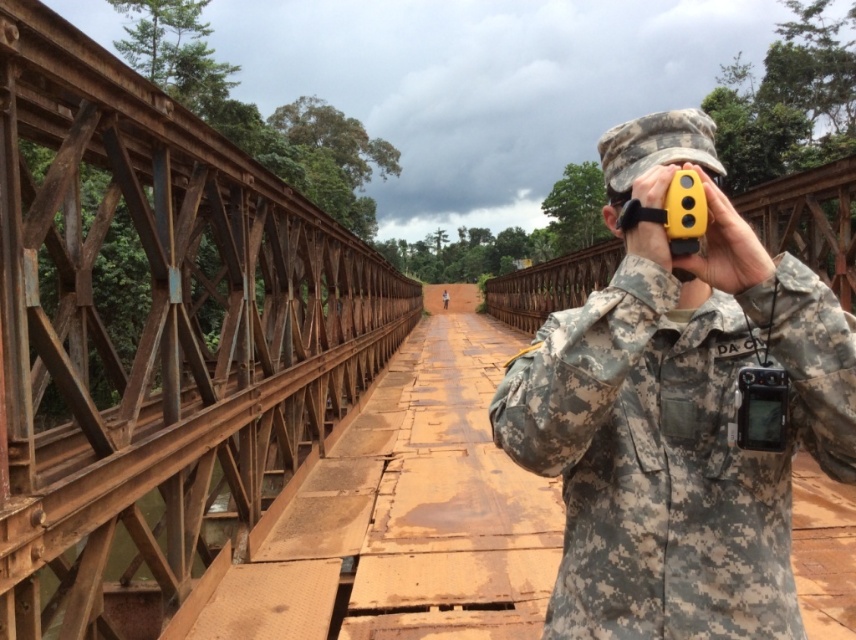
Question: Does rusty metal bridge at left appear over camouflage fabric binoculars at center?

Choices:
 (A) no
 (B) yes

Answer: (B)

Question: Which of the following is the farthest from the observer?

Choices:
 (A) (693, 330)
 (B) (199, 356)

Answer: (B)

Question: Which object is farther from the camera taking this photo?

Choices:
 (A) camouflage fabric binoculars at center
 (B) rusty metal bridge at left

Answer: (B)

Question: Does rusty metal bridge at left have a larger size compared to camouflage fabric binoculars at center?

Choices:
 (A) no
 (B) yes

Answer: (B)

Question: Does rusty metal bridge at left have a greater width compared to camouflage fabric binoculars at center?

Choices:
 (A) yes
 (B) no

Answer: (A)